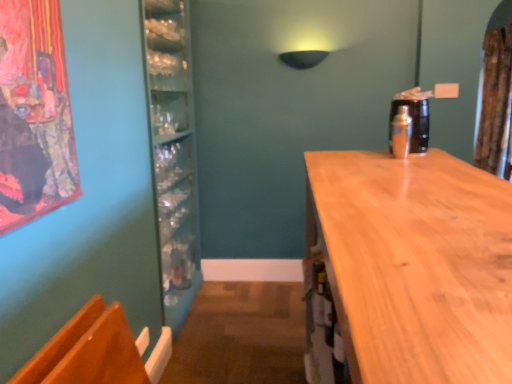
Question: From a real-world perspective, is shiny metallic shaker at right positioned under light brown wood countertop at right based on gravity?

Choices:
 (A) no
 (B) yes

Answer: (A)

Question: Is shiny metallic shaker at right not close to light brown wood countertop at right?

Choices:
 (A) no
 (B) yes

Answer: (A)

Question: Are shiny metallic shaker at right and light brown wood countertop at right beside each other?

Choices:
 (A) no
 (B) yes

Answer: (A)

Question: Is shiny metallic shaker at right shorter than light brown wood countertop at right?

Choices:
 (A) yes
 (B) no

Answer: (A)

Question: Would you say light brown wood countertop at right is part of shiny metallic shaker at right's contents?

Choices:
 (A) no
 (B) yes

Answer: (A)

Question: Is brown textured curtain at upper right wider or thinner than shiny metallic shaker at right?

Choices:
 (A) thin
 (B) wide

Answer: (B)

Question: From a real-world perspective, is brown textured curtain at upper right positioned above or below shiny metallic shaker at right?

Choices:
 (A) above
 (B) below

Answer: (A)

Question: Does point (497, 109) appear closer or farther from the camera than point (403, 130)?

Choices:
 (A) closer
 (B) farther

Answer: (B)

Question: Is brown textured curtain at upper right in front of or behind shiny metallic shaker at right in the image?

Choices:
 (A) behind
 (B) front

Answer: (A)

Question: Relative to light brown wood countertop at right, is brown textured curtain at upper right in front or behind?

Choices:
 (A) front
 (B) behind

Answer: (B)

Question: From a real-world perspective, is brown textured curtain at upper right above or below light brown wood countertop at right?

Choices:
 (A) above
 (B) below

Answer: (A)

Question: Is brown textured curtain at upper right bigger or smaller than light brown wood countertop at right?

Choices:
 (A) big
 (B) small

Answer: (B)

Question: In terms of width, does brown textured curtain at upper right look wider or thinner when compared to light brown wood countertop at right?

Choices:
 (A) wide
 (B) thin

Answer: (B)

Question: Based on their sizes in the image, would you say brown textured curtain at upper right is bigger or smaller than wooden armchair at lower left?

Choices:
 (A) small
 (B) big

Answer: (B)

Question: From a real-world perspective, is brown textured curtain at upper right positioned above or below wooden armchair at lower left?

Choices:
 (A) below
 (B) above

Answer: (B)